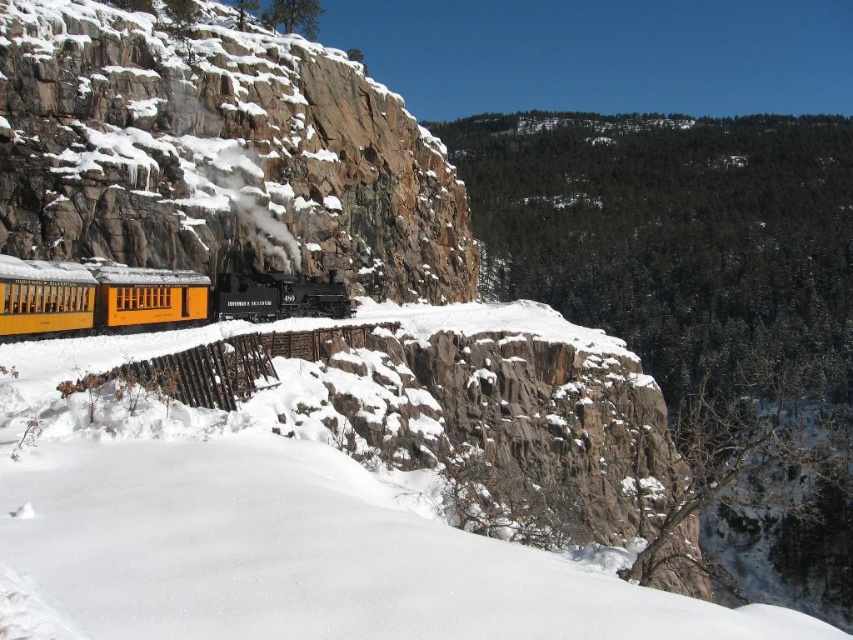
Question: Does rocky cliff at center appear under yellow matte train car at center?

Choices:
 (A) yes
 (B) no

Answer: (B)

Question: Can you confirm if rocky cliff at center is bigger than yellow matte train car at center?

Choices:
 (A) yes
 (B) no

Answer: (A)

Question: Which object appears closest to the camera in this image?

Choices:
 (A) yellow matte train car at center
 (B) rocky cliff at center

Answer: (A)

Question: Which of the following is the farthest from the observer?

Choices:
 (A) yellow matte train car at center
 (B) rocky cliff at center

Answer: (B)

Question: Is rocky cliff at center to the left of yellow matte train car at center from the viewer's perspective?

Choices:
 (A) yes
 (B) no

Answer: (B)